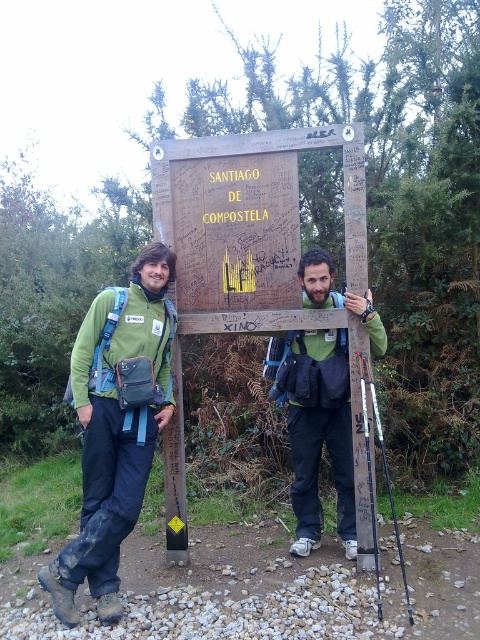
You are a hiker who wants to ensure your gear is properly arranged. You have a green fabric backpack at center and a black plastic ski pole at right. Which item is placed higher up?

The green fabric backpack at center is positioned over the black plastic ski pole at right, so it is placed higher up.

You are a hiker who just arrived at the Santiago de Compostela signpost. You need to place your water bottle between the green fabric backpack at center and the black plastic ski pole at right. Which side should you place it on to be closer to the backpack?

Place the water bottle to the left of the black plastic ski pole at right, as the green fabric backpack at center is located to the left of the black plastic ski pole at right.

You are planning to pack your gear into the green fabric backpack at center and the green matte jacket at center. Which item has a larger width to accommodate more items?

The green matte jacket at center has a larger width than the green fabric backpack at center, so it can accommodate more items.